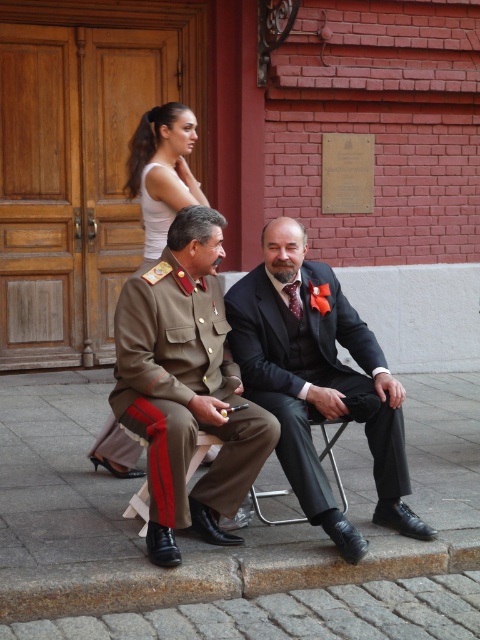
Is khaki uniform at center to the left of matte brown uniform at center from the viewer's perspective?

Yes, khaki uniform at center is to the left of matte brown uniform at center.

Which of these two, khaki uniform at center or matte brown uniform at center, stands taller?

matte brown uniform at center is taller.

Who is more distant from viewer, (x=136, y=406) or (x=257, y=275)?

Point (x=257, y=275)

Image resolution: width=480 pixels, height=640 pixels. I want to click on khaki uniform at center, so click(x=186, y=387).

Which is below, matte brown uniform at center or matte black suit at center?

matte brown uniform at center is lower down.

Can you confirm if matte brown uniform at center is shorter than matte black suit at center?

No.

Who is more distant from viewer, (373, 468) or (399, 456)?

The point (373, 468) is more distant.

What are the coordinates of `matte brown uniform at center` in the screenshot? It's located at (317, 380).

Is point (168, 516) positioned before point (169, 152)?

Yes, point (168, 516) is closer to viewer.

Does khaki uniform at center have a greater height compared to white fabric dress at upper center?

Correct, khaki uniform at center is much taller as white fabric dress at upper center.

Between point (145, 291) and point (169, 109), which one is positioned in front?

Positioned in front is point (145, 291).

Find the location of a particular element. The height and width of the screenshot is (640, 480). khaki uniform at center is located at coordinates (186, 387).